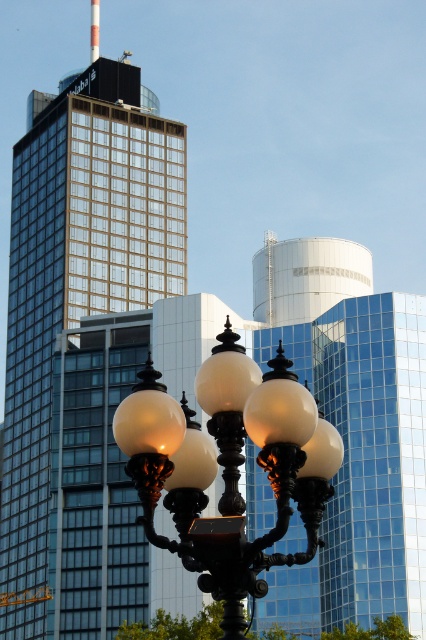
Which is more to the left, matte glass skyscraper at center or matte black street light at center?

matte glass skyscraper at center is more to the left.

Image resolution: width=426 pixels, height=640 pixels. Describe the element at coordinates (77, 305) in the screenshot. I see `matte glass skyscraper at center` at that location.

The image size is (426, 640). In order to click on matte glass skyscraper at center in this screenshot , I will do `click(77, 305)`.